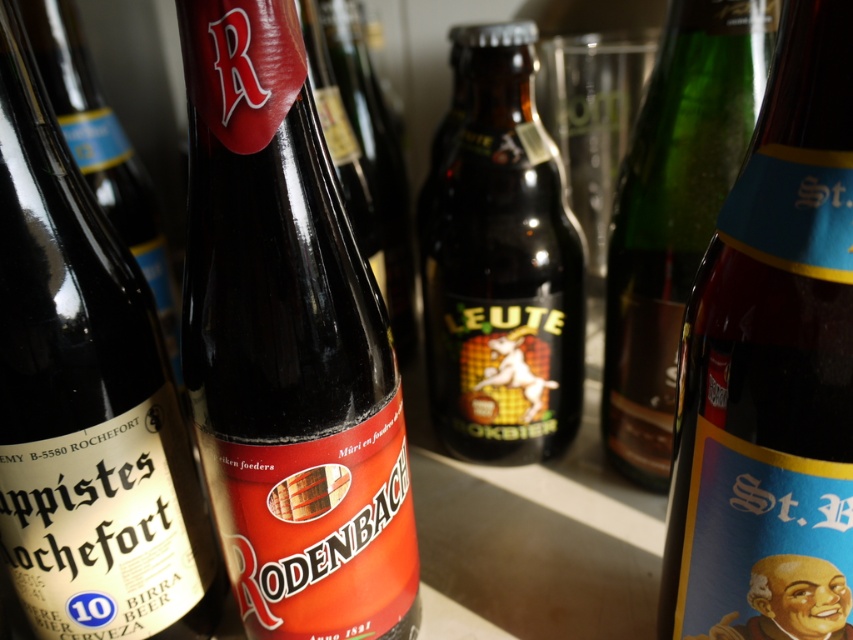
You are standing in front of a shelf with two points marked. The first point is at coordinates point (x=279, y=125) and the second is at point (x=625, y=205). Which point is closer to you?

Point (x=279, y=125) is in front of point (x=625, y=205), so it is closer to you.

You are looking at a shelf with two bottles. The shiny dark glass bottle at center and the green glass bottle at center. Which one is positioned to the left?

The shiny dark glass bottle at center is to the left of the green glass bottle at center.

Looking at the beer bottles on the shelf, which one is shorter between the shiny dark glass bottle at center and the green glass bottle at center?

The shiny dark glass bottle at center is shorter than the green glass bottle at center.